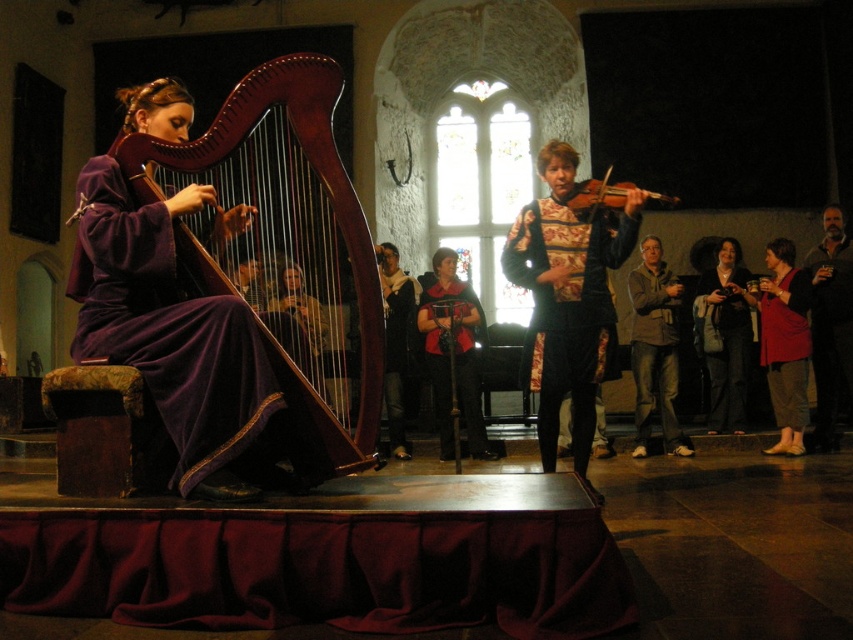
Question: Does jeans at right have a greater width compared to velvet red cape at center?

Choices:
 (A) yes
 (B) no

Answer: (A)

Question: Which of the following is the farthest from the observer?

Choices:
 (A) wooden violin at right
 (B) dark brown leather jacket at center
 (C) matte red robe at lower right
 (D) jeans at right

Answer: (D)

Question: Which of the following is the closest to the observer?

Choices:
 (A) (202, 346)
 (B) (631, 332)
 (C) (598, 218)
 (D) (432, 298)

Answer: (A)

Question: Is floral brocade robe at right wider than dark brown leather jacket at lower right?

Choices:
 (A) no
 (B) yes

Answer: (B)

Question: Can you confirm if matte red robe at lower right is smaller than wooden violin at right?

Choices:
 (A) yes
 (B) no

Answer: (A)

Question: Which point is closer to the camera?

Choices:
 (A) matte red robe at lower right
 (B) dark brown leather jacket at center
 (C) velvet red cape at center

Answer: (B)